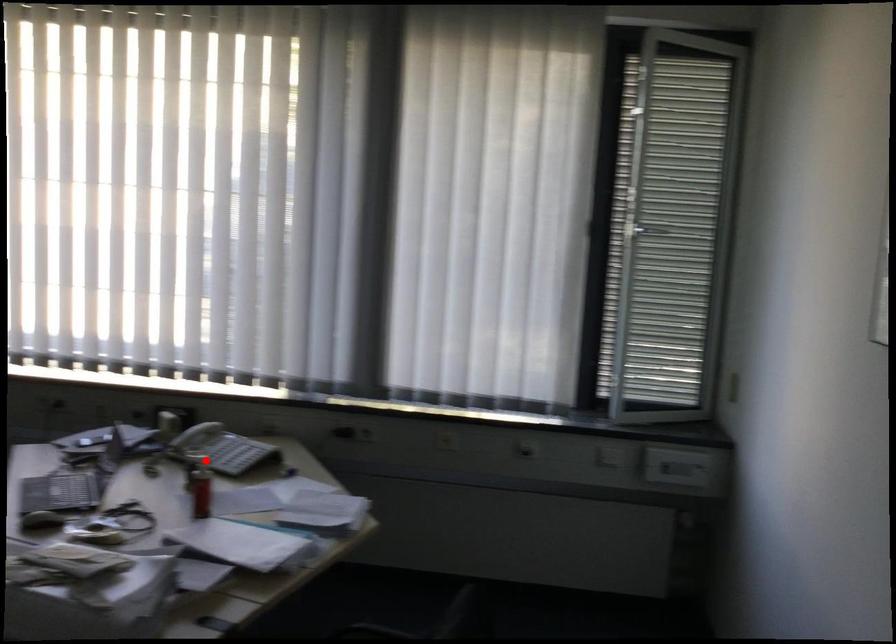
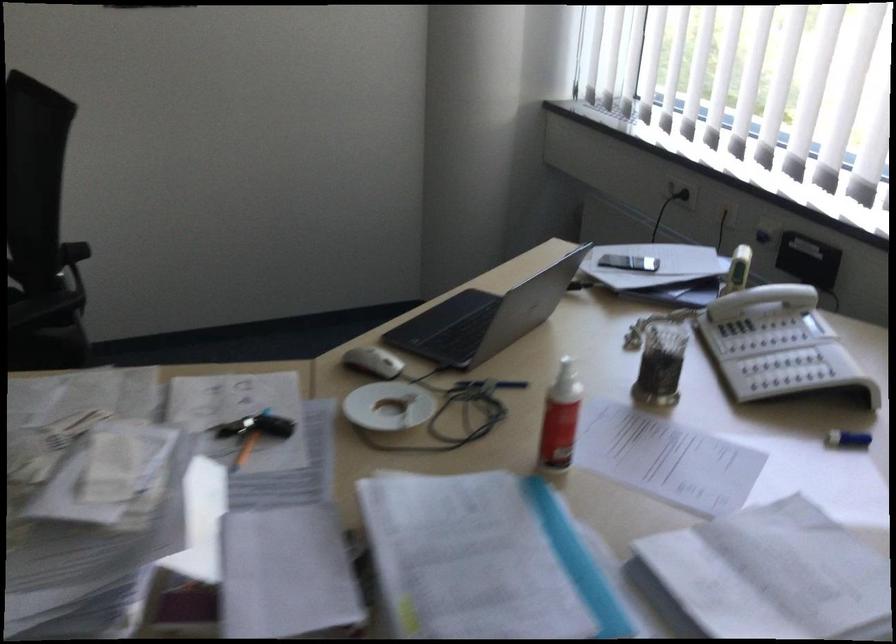
Find the pixel in the second image that matches the highlighted location in the first image.

(567, 375)